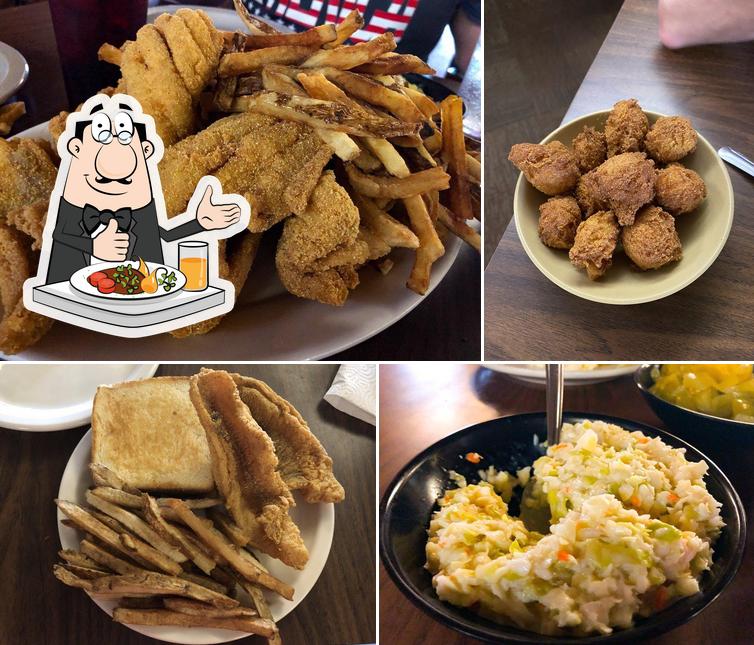
At what (x,y) coordinates should I click in order to perform the action: click on bowl. Please return your answer as a coordinate pair (x, y). Looking at the image, I should click on (632, 283), (409, 515), (730, 430).